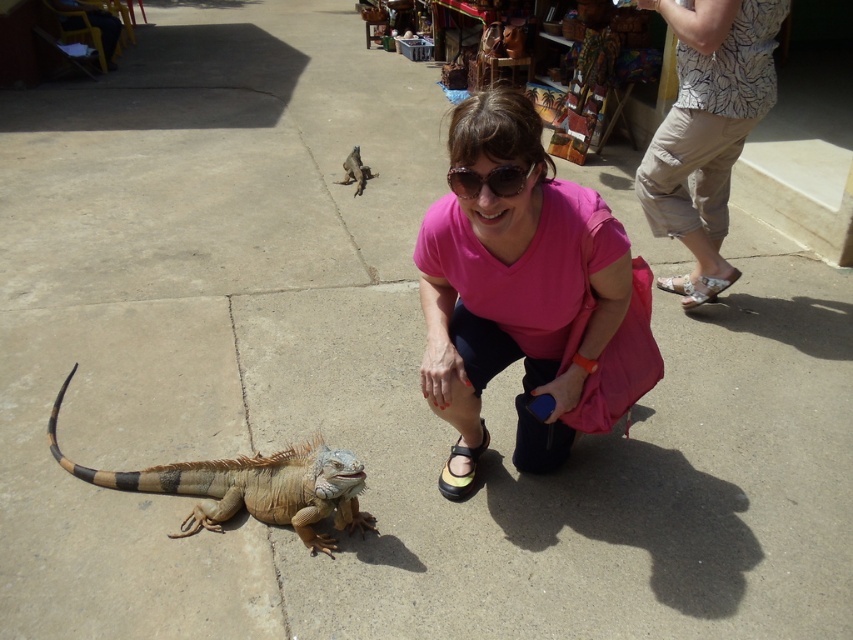
The height and width of the screenshot is (640, 853). Describe the element at coordinates (529, 292) in the screenshot. I see `pink fabric at center` at that location.

Between point (612, 410) and point (498, 186), which one is positioned in front?

Point (498, 186)

The width and height of the screenshot is (853, 640). In order to click on pink fabric at center in this screenshot , I will do `click(529, 292)`.

Is pink fabric at center below brown scaly lizard at upper center?

Correct, pink fabric at center is located below brown scaly lizard at upper center.

Is point (630, 348) closer to viewer compared to point (358, 164)?

Yes, it is.

The image size is (853, 640). In order to click on pink fabric at center in this screenshot , I will do `click(529, 292)`.

Which is behind, point (561, 224) or point (468, 492)?

The point (468, 492) is more distant.

Find the location of `pink fabric at center`. pink fabric at center is located at coordinates click(x=529, y=292).